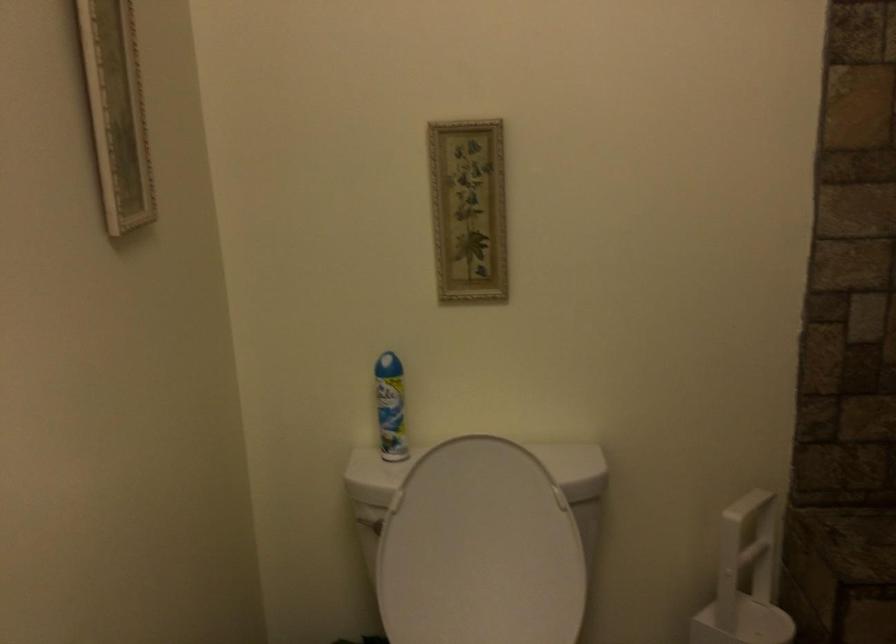
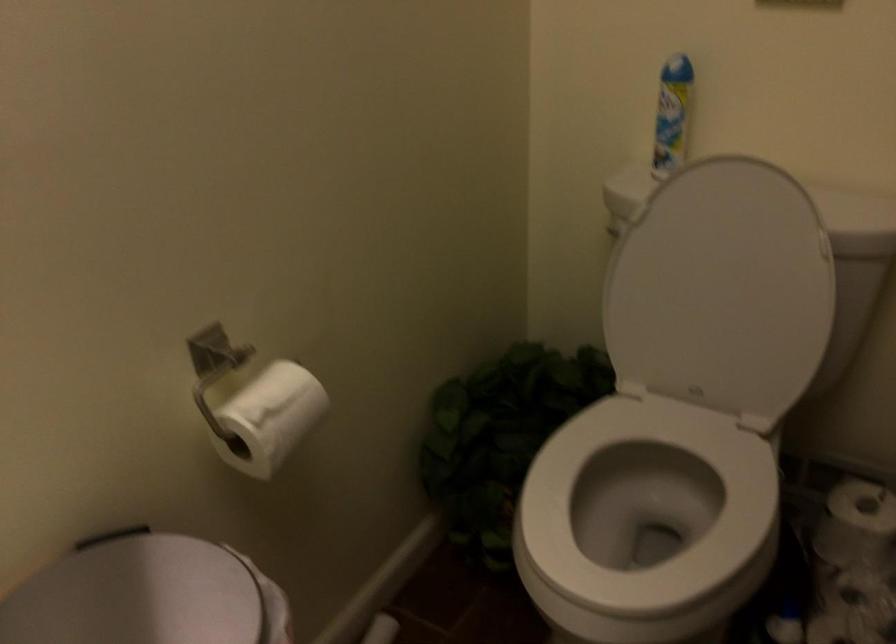
The images are taken continuously from a first-person perspective. In which direction is your viewpoint rotating?

The camera's rotation is toward left-down.